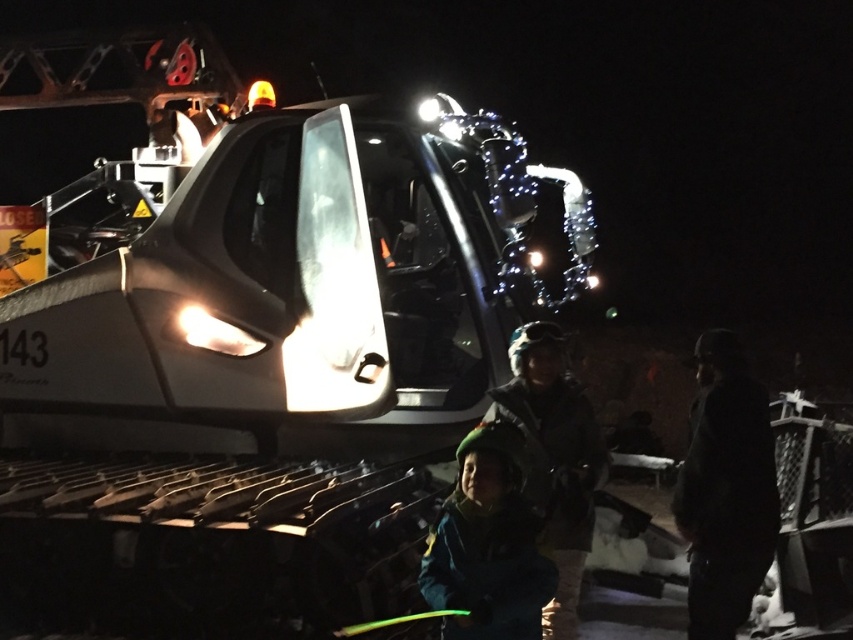
Is point (711, 349) positioned in front of point (553, 438)?

Yes, point (711, 349) is closer to viewer.

Which is behind, point (738, 394) or point (519, 412)?

Point (519, 412)

Is point (706, 620) closer to viewer compared to point (578, 429)?

Yes, it is in front of point (578, 429).

Locate an element on the screen. The height and width of the screenshot is (640, 853). dark woolen hat at center is located at coordinates (724, 490).

Can you confirm if green fuzzy hat at lower center is smaller than dark green jacket at center?

Correct, green fuzzy hat at lower center occupies less space than dark green jacket at center.

Between green fuzzy hat at lower center and dark green jacket at center, which one appears on the left side from the viewer's perspective?

Positioned to the left is green fuzzy hat at lower center.

Which is in front, point (468, 508) or point (556, 625)?

Point (468, 508) is more forward.

Find the location of a particular element. The width and height of the screenshot is (853, 640). green fuzzy hat at lower center is located at coordinates (486, 545).

Consider the image. Is dark woolen hat at center taller than green fuzzy hat at lower center?

Yes.

The image size is (853, 640). In order to click on dark woolen hat at center in this screenshot , I will do `click(724, 490)`.

Describe the element at coordinates (724, 490) in the screenshot. I see `dark woolen hat at center` at that location.

Where is `dark woolen hat at center`? Image resolution: width=853 pixels, height=640 pixels. dark woolen hat at center is located at coordinates (724, 490).